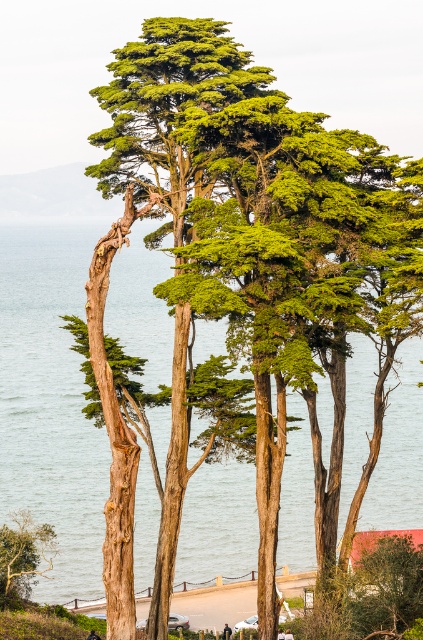
You are standing at the point marked by the coordinates point (51, 403) in the coastal scene. What is the color of the surface you are currently standing on?

The point (51, 403) indicates green water at center, so the surface you are standing on is green water.

You are standing on the beach and want to take a photo of both the green water at center and the green leafy tree at lower left. Since you want both to be fully visible in the frame, which object should you position closer to the edge of the camera frame to avoid cropping?

You should position the green water at center closer to the edge of the camera frame because its width is greater than the green leafy tree at lower left, so it requires more space to be fully visible.